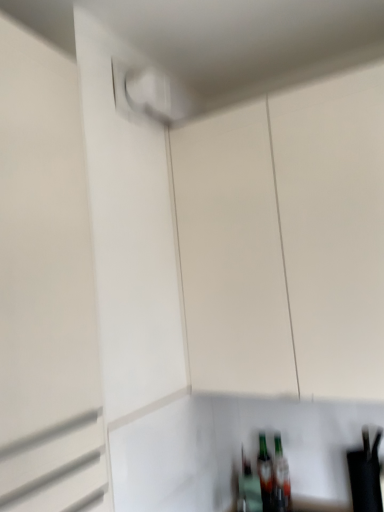
At what (x,y) coordinates should I click in order to perform the action: click on white matte cabinet at center. Please return your answer as a coordinate pair (x, y). The image size is (384, 512). Looking at the image, I should click on tap(286, 241).

The height and width of the screenshot is (512, 384). What do you see at coordinates (286, 241) in the screenshot?
I see `white matte cabinet at center` at bounding box center [286, 241].

What is the approximate height of white matte cabinet at center?

The height of white matte cabinet at center is 1.01 meters.

The image size is (384, 512). Find the location of `white matte garage door at upper left`. white matte garage door at upper left is located at coordinates (46, 288).

Describe the element at coordinates (46, 288) in the screenshot. I see `white matte garage door at upper left` at that location.

In order to click on white matte cabinet at center in this screenshot , I will do tap(286, 241).

Would you say white matte cabinet at center is to the left or to the right of white matte garage door at upper left in the picture?

Clearly, white matte cabinet at center is on the right of white matte garage door at upper left in the image.

Does white matte cabinet at center lie in front of white matte garage door at upper left?

No, white matte cabinet at center is behind white matte garage door at upper left.

Does point (197, 211) come farther from viewer compared to point (25, 450)?

Yes.

From the image's perspective, is white matte cabinet at center located beneath white matte garage door at upper left?

Incorrect, from the image's perspective, white matte cabinet at center is higher than white matte garage door at upper left.

From a real-world perspective, is white matte cabinet at center below white matte garage door at upper left?

No, from a real-world perspective, white matte cabinet at center is not below white matte garage door at upper left.

Between white matte cabinet at center and white matte garage door at upper left, which one has smaller width?

white matte garage door at upper left.

Considering the relative sizes of white matte cabinet at center and white matte garage door at upper left in the image provided, is white matte cabinet at center taller than white matte garage door at upper left?

No, white matte cabinet at center is not taller than white matte garage door at upper left.

Considering the sizes of objects white matte cabinet at center and white matte garage door at upper left in the image provided, who is bigger, white matte cabinet at center or white matte garage door at upper left?

With larger size is white matte cabinet at center.

Is white matte cabinet at center situated inside white matte garage door at upper left or outside?

white matte cabinet at center is outside white matte garage door at upper left.

Is white matte cabinet at center not close to white matte garage door at upper left?

They are positioned close to each other.

From the picture: Is white matte cabinet at center turned away from white matte garage door at upper left?

That's not correct — white matte cabinet at center is not looking away from white matte garage door at upper left.

At what (x,y) coordinates should I click in order to perform the action: click on garage door below the white matte cabinet at center (from the image's perspective). Please return your answer as a coordinate pair (x, y). This screenshot has width=384, height=512. Looking at the image, I should click on (46, 288).

Is white matte garage door at upper left to the left of white matte cabinet at center from the viewer's perspective?

Indeed, white matte garage door at upper left is positioned on the left side of white matte cabinet at center.

Is white matte garage door at upper left in front of white matte cabinet at center?

Yes, white matte garage door at upper left is closer to the viewer.

Is point (45, 54) more distant than point (272, 388)?

No, it is in front of (272, 388).

From the image's perspective, who appears lower, white matte garage door at upper left or white matte cabinet at center?

From the image's view, white matte garage door at upper left is below.

From a real-world perspective, who is located higher, white matte garage door at upper left or white matte cabinet at center?

white matte cabinet at center.

Considering the relative sizes of white matte garage door at upper left and white matte cabinet at center in the image provided, is white matte garage door at upper left thinner than white matte cabinet at center?

Yes, white matte garage door at upper left is thinner than white matte cabinet at center.

Can you confirm if white matte garage door at upper left is taller than white matte cabinet at center?

Indeed, white matte garage door at upper left has a greater height compared to white matte cabinet at center.

Who is bigger, white matte garage door at upper left or white matte cabinet at center?

white matte cabinet at center is bigger.

Would you say white matte garage door at upper left contains white matte cabinet at center?

Definitely not — white matte cabinet at center is not inside white matte garage door at upper left.

Is white matte garage door at upper left far from white matte cabinet at center?

No, white matte garage door at upper left is in close proximity to white matte cabinet at center.

Could you tell me if white matte garage door at upper left is facing white matte cabinet at center?

No.

Image resolution: width=384 pixels, height=512 pixels. Identify the location of garage door below the white matte cabinet at center (from a real-world perspective). (46, 288).

In order to click on cabinetry behind the white matte garage door at upper left in this screenshot , I will do `click(286, 241)`.

Locate an element on the screen. The height and width of the screenshot is (512, 384). cabinetry above the white matte garage door at upper left (from the image's perspective) is located at coordinates (286, 241).